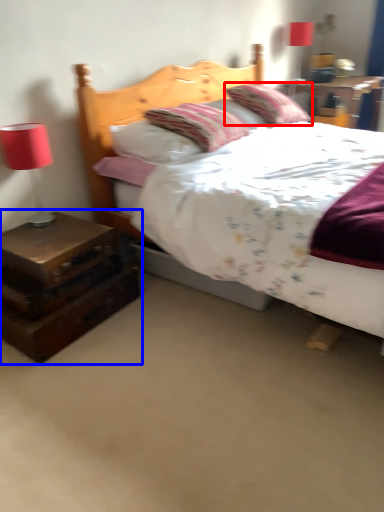
Question: Which object appears farthest to the camera in this image, pillow (highlighted by a red box) or nightstand (highlighted by a blue box)?

Choices:
 (A) pillow
 (B) nightstand

Answer: (A)